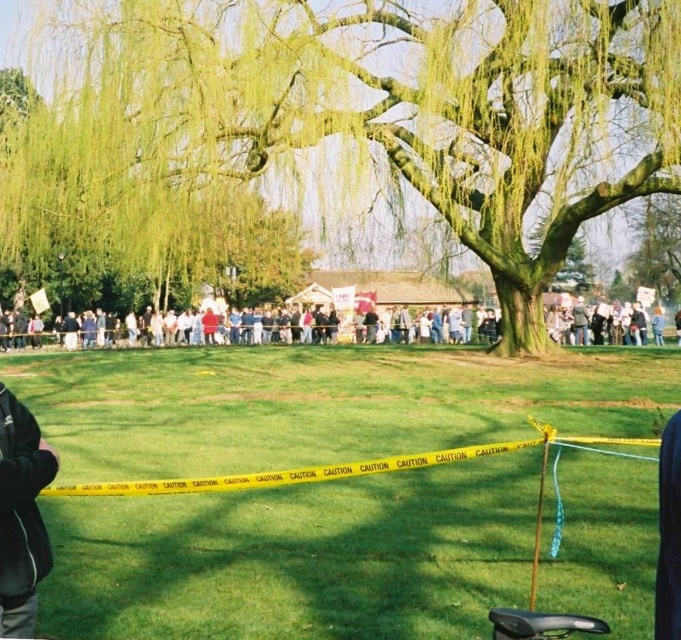
Based on the photo, you are a photographer trying to capture a clear shot of the dark gray fleece jacket at left without the multicolored fabric crowd at center blocking it. Based on their sizes, can you suggest a way to adjust your position or angle to achieve this?

The multicolored fabric crowd at center is taller than the dark gray fleece jacket at left. To avoid the crowd blocking the jacket, you could lower your camera angle or move to a lower position to capture the jacket below the crowd.

You are a park ranger trying to determine if the green leafy tree at center can be seen from the multicolored fabric crowd at center. Based on their widths, can the tree be fully visible to the crowd?

The green leafy tree at center has a lesser width compared to the multicolored fabric crowd at center. Since the tree is narrower, it is possible that the tree can be fully visible to the crowd as long as there are no obstructions between them.

You are a park visitor who wants to take a photo of the green leafy tree at center without the dark gray fleece jacket at left appearing in the shot. Since you can only move sideways, can you adjust your position to exclude the jacket from the frame?

The green leafy tree at center is wider than the dark gray fleece jacket at left. By moving sideways to the left or right, you can position yourself so that the tree covers the jacket or shifts it out of the frame.